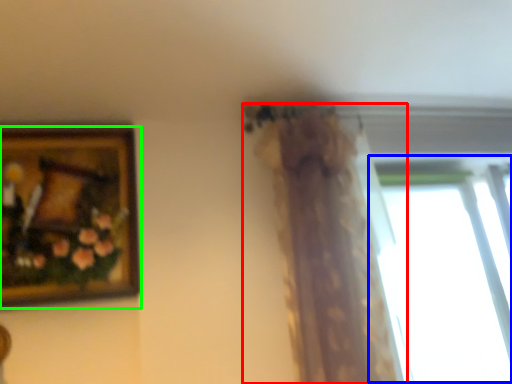
Question: Considering the real-world distances, which object is closest to curtain (highlighted by a red box)? window (highlighted by a blue box) or picture frame (highlighted by a green box).

Choices:
 (A) window
 (B) picture frame

Answer: (B)